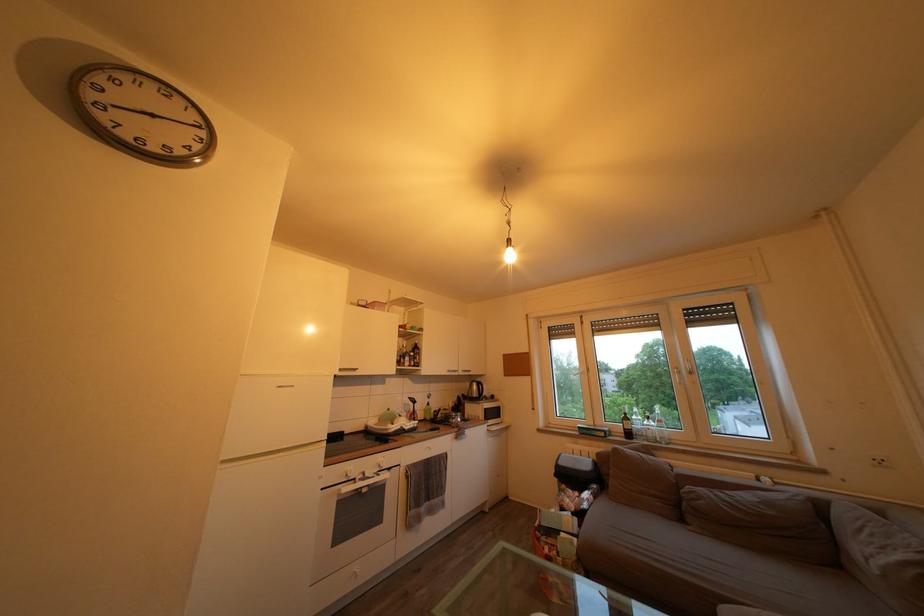
Locate an element on the screen. This screenshot has width=924, height=616. wall power outlet is located at coordinates (879, 460).